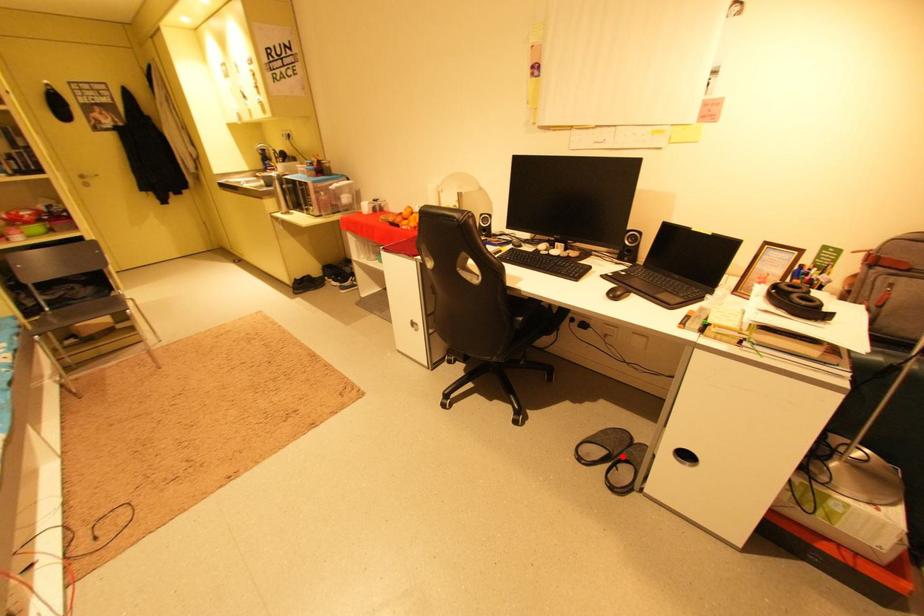
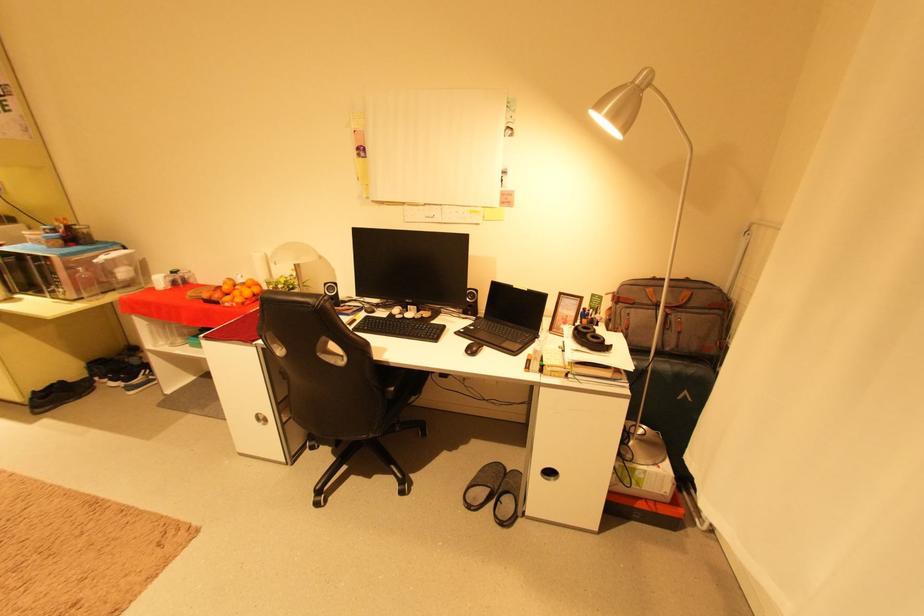
Locate, in the second image, the point that corresponds to the highlighted location in the first image.

(504, 492)